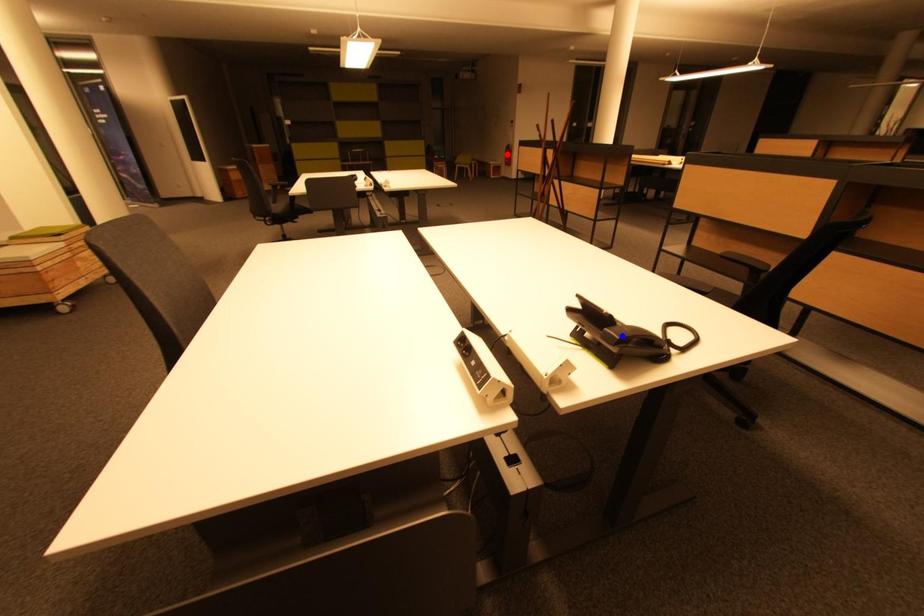
Question: In the image, two points are highlighted. Which point is nearer to the camera? Reply with the corresponding letter.

Choices:
 (A) blue point
 (B) red point

Answer: (A)